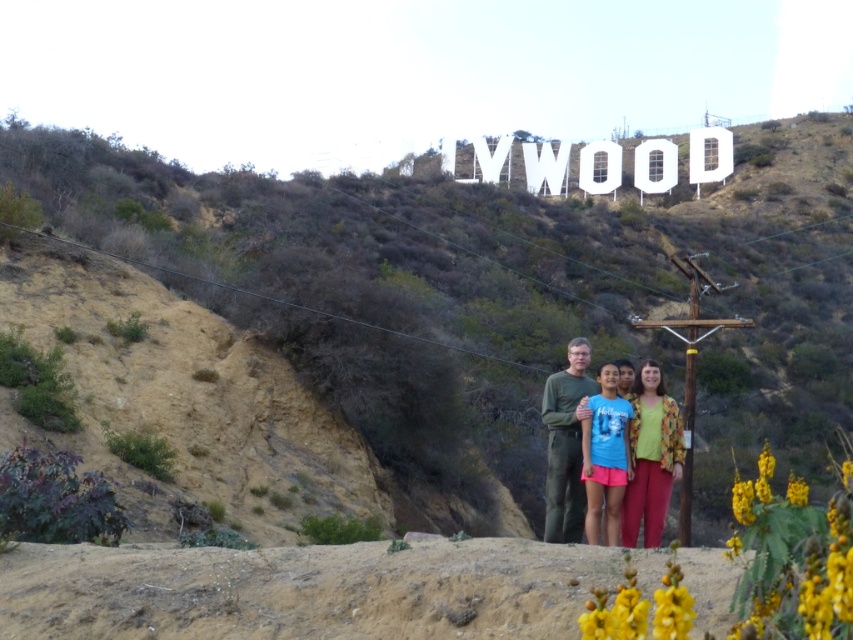
You are standing in front of the VWOOD sign and see the point at coordinates (x=651, y=458). What object is located at that point?

The point at coordinates (x=651, y=458) corresponds to the floral patterned blouse at center.

You are a photographer trying to capture a clear shot of both the matte green shirt at center and the green matte shirt at center in the group photo. Since they are both at the center, which one should you focus on first to ensure both are in focus?

The matte green shirt at center is located above the green matte shirt at center, so focusing on the upper one first would help ensure both are in focus.